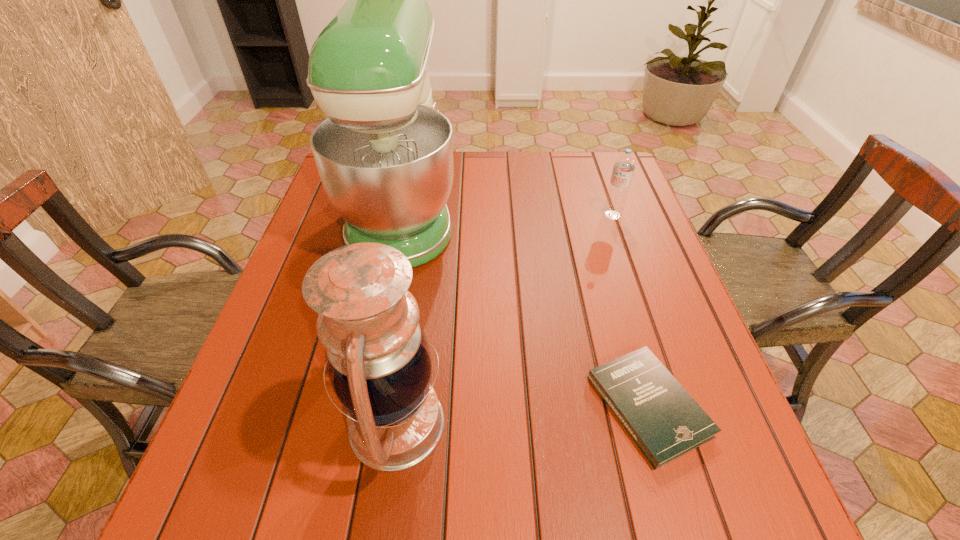
Identify the location of free space between the book and the water bottle. The width and height of the screenshot is (960, 540). (631, 310).

At what (x,y) coordinates should I click in order to perform the action: click on unoccupied position between the water bottle and the shortest object. Please return your answer as a coordinate pair (x, y). This screenshot has height=540, width=960. Looking at the image, I should click on (631, 310).

Locate an element on the screen. empty space between the second tallest object and the second shortest object is located at coordinates (504, 319).

You are a GUI agent. You are given a task and a screenshot of the screen. Output one action in this format:
    pyautogui.click(x=<x>, y=<y>)
    Task: Click on the free space between the book and the second tallest object
    
    Given the screenshot: What is the action you would take?
    pyautogui.click(x=522, y=415)

Where is `vacant space that is in between the mixer and the second shortest object`? Image resolution: width=960 pixels, height=540 pixels. vacant space that is in between the mixer and the second shortest object is located at coordinates (508, 213).

Where is `vacant space that is in between the water bottle and the second tallest object`? This screenshot has width=960, height=540. vacant space that is in between the water bottle and the second tallest object is located at coordinates (504, 319).

The width and height of the screenshot is (960, 540). Identify the location of blank region between the tallest object and the water bottle. [508, 213].

Identify which object is the second closest to the shortest object. Please provide its 2D coordinates. Your answer should be formatted as a tuple, i.e. [(x, y)], where the tuple contains the x and y coordinates of a point satisfying the conditions above.

[(384, 154)]

What are the coordinates of `the second closest object to the mixer` in the screenshot? It's located at (665, 422).

Where is `blank space that satisfies the following two spatial constraints: 1. on the controls of the mixer; 2. on the left side of the oil lamp`? blank space that satisfies the following two spatial constraints: 1. on the controls of the mixer; 2. on the left side of the oil lamp is located at coordinates (360, 423).